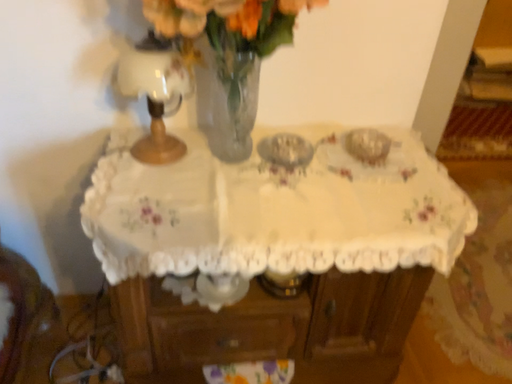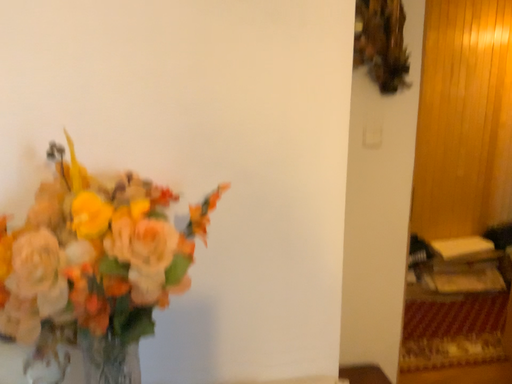
Question: Which way did the camera rotate in the video?

Choices:
 (A) rotated upward
 (B) rotated downward

Answer: (A)